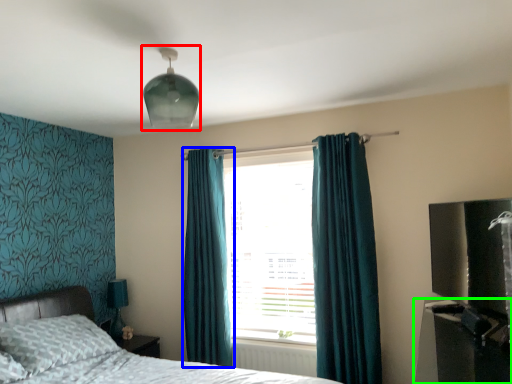
Question: Based on their relative distances, which object is nearer to light fixture (highlighted by a red box)? Choose from curtain (highlighted by a blue box) and entertainment center (highlighted by a green box).

Choices:
 (A) curtain
 (B) entertainment center

Answer: (A)